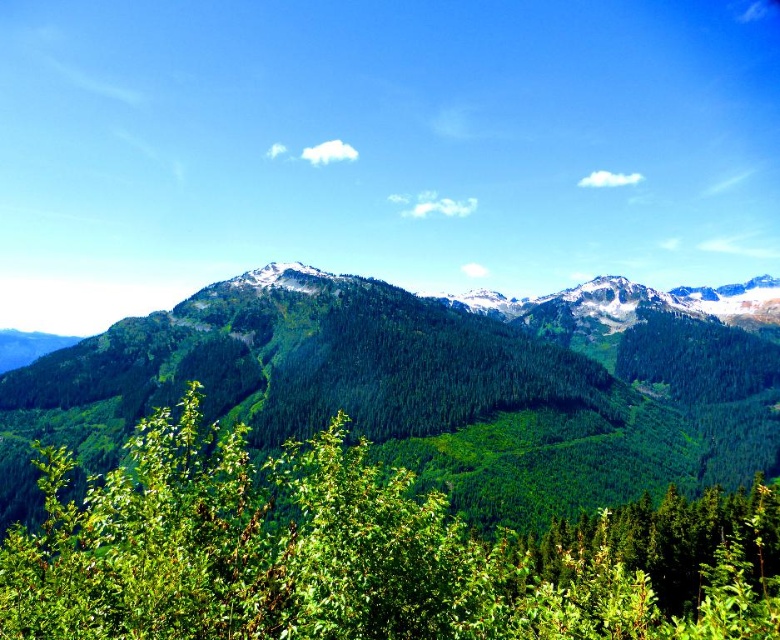
Consider the image. You are a hiker standing at the base of the green leafy tree at center. You want to reach the green forested mountain range at center. Given that your average walking pace is 3 miles per hour, how long will it take you to reach the mountain range?

The distance between the green forested mountain range at center and the green leafy tree at center is 228.39 feet. Converting this distance to miles, it is approximately 0.043 miles. At a walking pace of 3 miles per hour, it would take roughly 0.86 minutes, or about 52 seconds to reach the mountain range.

Consider the image. You are standing in a mountain landscape and see the green forested mountain range at center and the green leafy tree at center. Which one is positioned to the right of the other?

The green forested mountain range at center is positioned to the right of the green leafy tree at center.